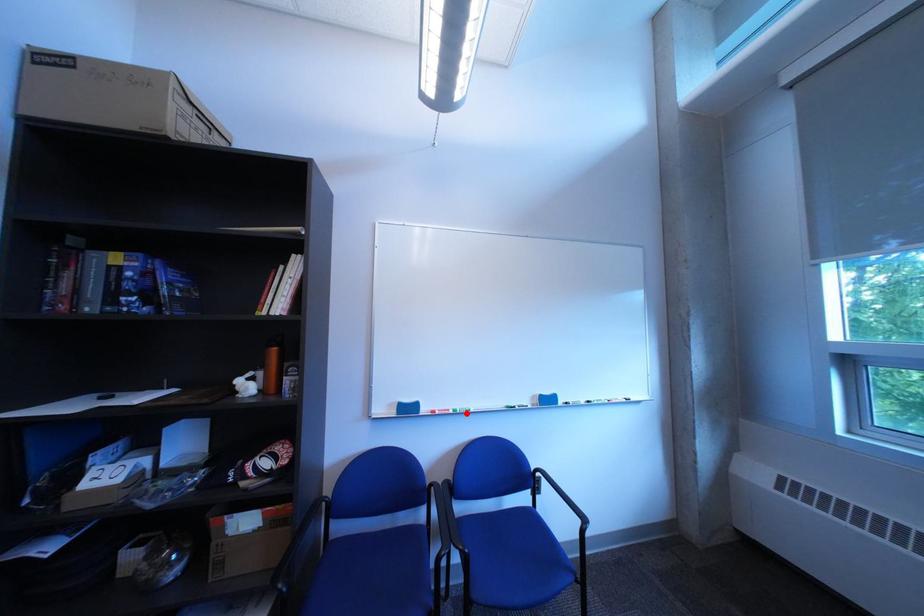
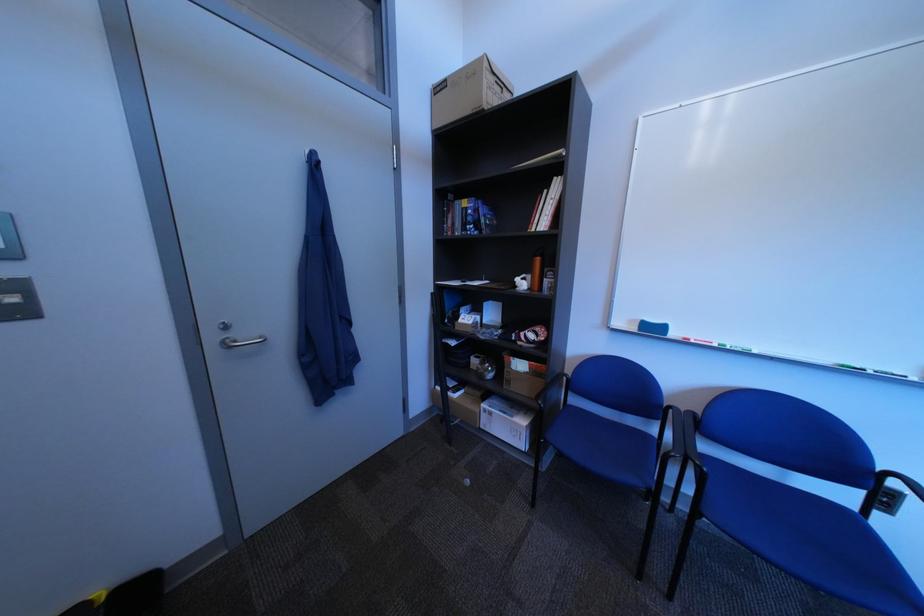
Find the pixel in the second image that matches the highlighted location in the first image.

(732, 347)